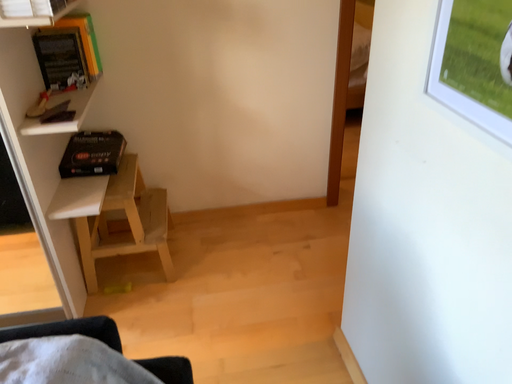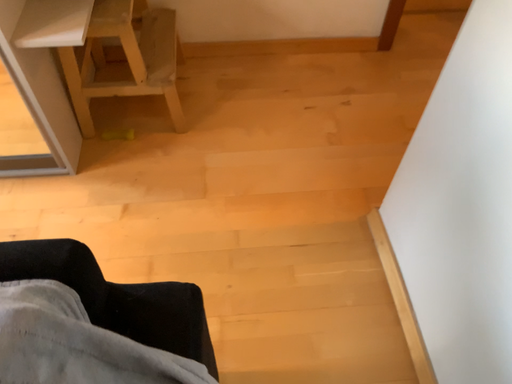
Question: Which way did the camera rotate in the video?

Choices:
 (A) rotated downward
 (B) rotated upward

Answer: (A)